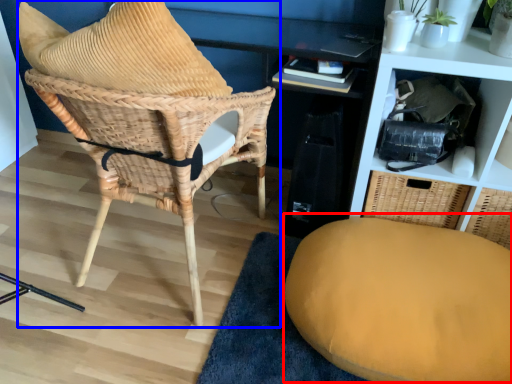
Question: Among these objects, which one is nearest to the camera, swivel chair (highlighted by a red box) or chair (highlighted by a blue box)?

Choices:
 (A) swivel chair
 (B) chair

Answer: (B)